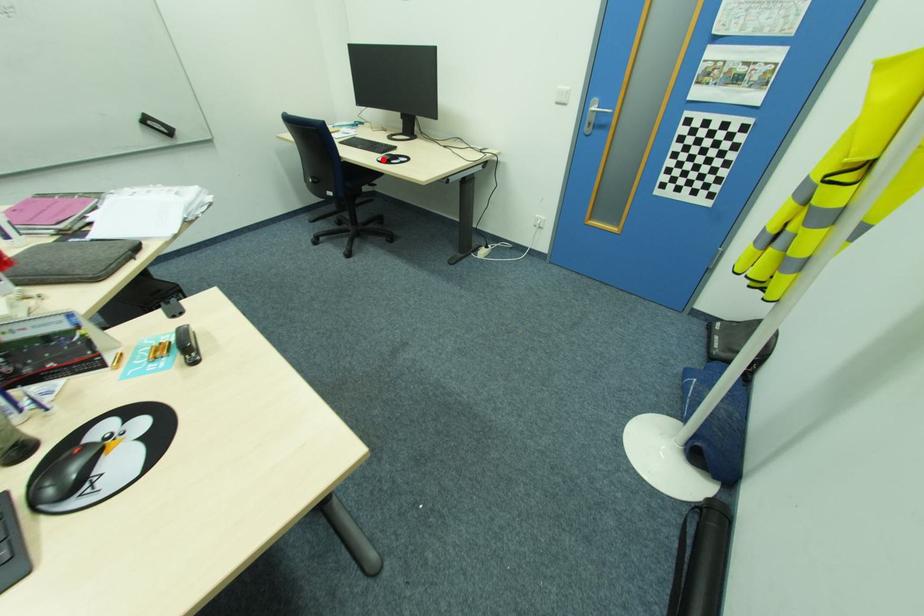
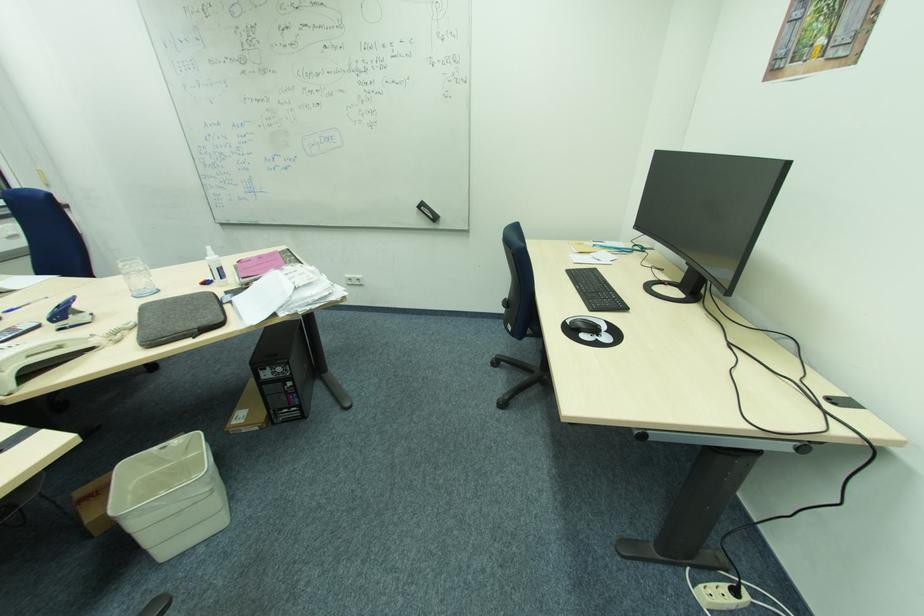
Where in the second image is the point corresponding to the highlighted location from the first image?

(572, 323)